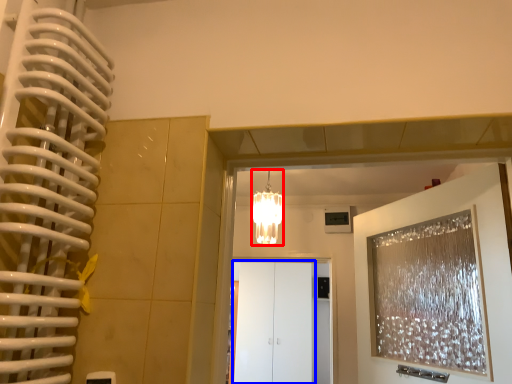
Question: Among these objects, which one is farthest to the camera, lamp (highlighted by a red box) or glass door (highlighted by a blue box)?

Choices:
 (A) lamp
 (B) glass door

Answer: (B)